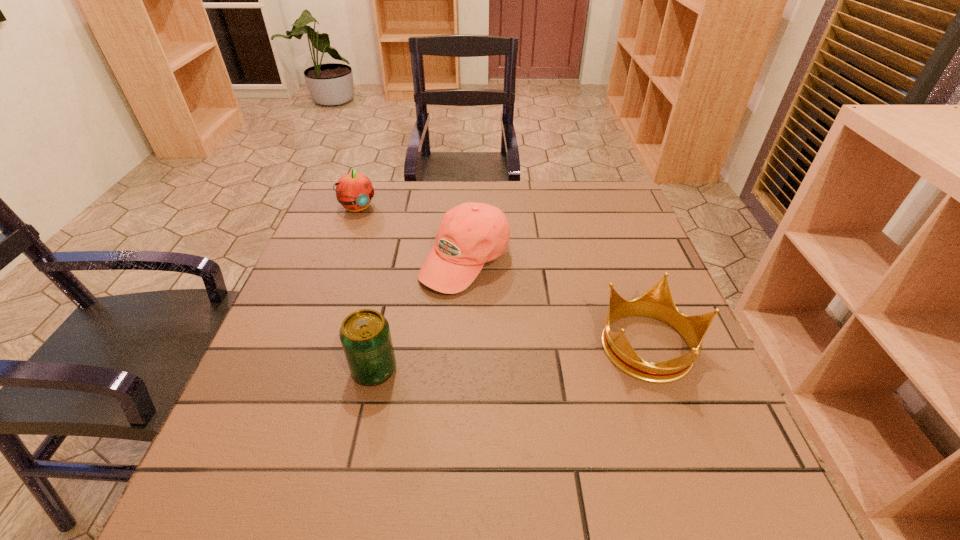
I want to click on vacant area that lies between the second object from right to left and the second object from left to right, so click(420, 316).

What are the coordinates of `vacant space that is in between the crown and the third object from right to left` in the screenshot? It's located at (513, 358).

Identify which object is the closest to the third object from left to right. Please provide its 2D coordinates. Your answer should be formatted as a tuple, i.e. [(x, y)], where the tuple contains the x and y coordinates of a point satisfying the conditions above.

[(365, 336)]

The image size is (960, 540). I want to click on object that is the nearest to the crown, so click(470, 234).

I want to click on vacant area in the image that satisfies the following two spatial constraints: 1. on the back side of the third object from right to left; 2. on the right side of the baseball cap, so click(397, 262).